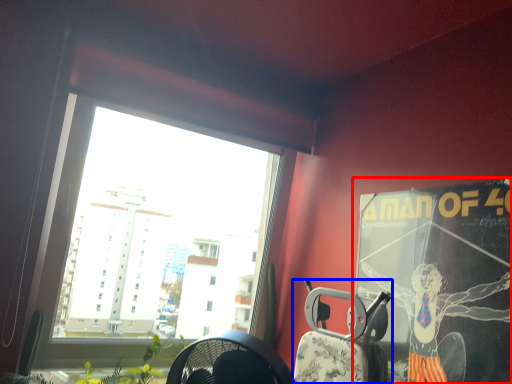
Question: Which point is closer to the camera, poster page (highlighted by a red box) or armchair (highlighted by a blue box)?

Choices:
 (A) poster page
 (B) armchair

Answer: (A)